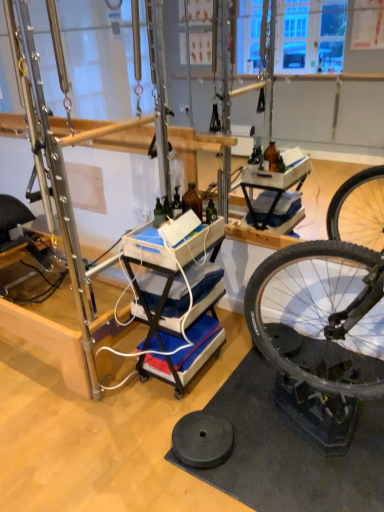
Identify the location of vacant area that is in front of wooden tray at center. The height and width of the screenshot is (512, 384). (183, 409).